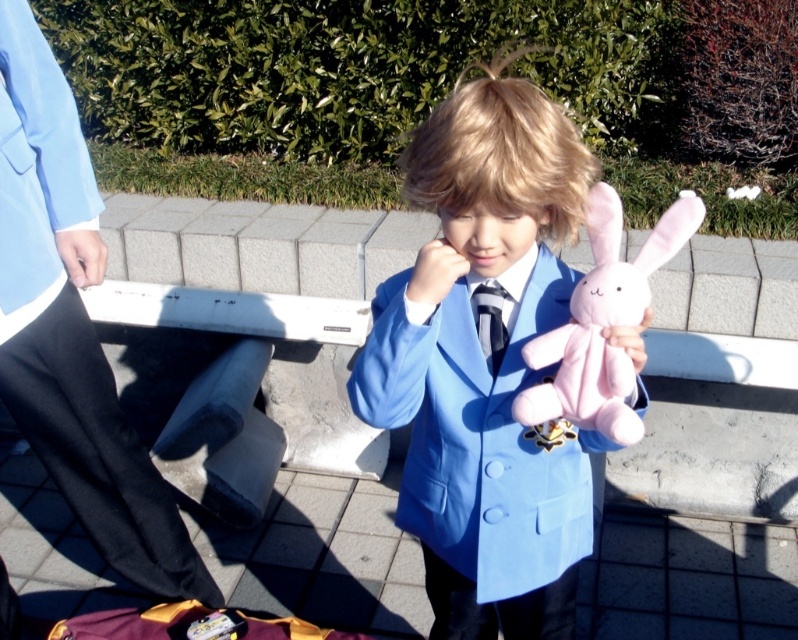
You are a photographer trying to capture the child in the center of the image. The child is wearing a blue blazer. There is a point marked at coordinates (484, 364). What is the significance of this point in relation to the child?

The point at coordinates (484, 364) marks the location of the matte blue suit at center, which is the child wearing the blue blazer.

The child is wearing a matte blue suit at center and a matte black tie at center. Which clothing item is wider?

The matte blue suit at center is wider than the matte black tie at center.